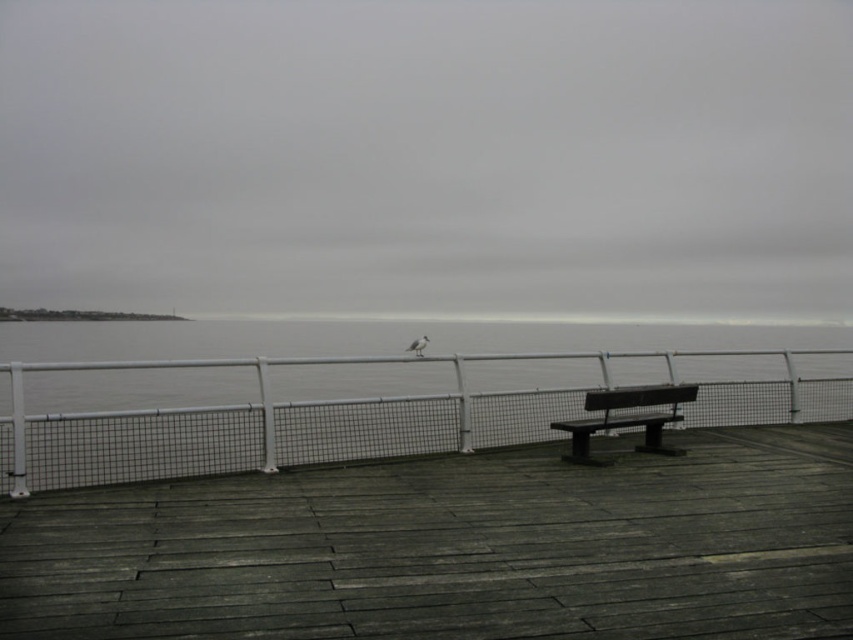
Consider the image. You are standing on the wooden deck and want to look at both the gray cloudy sky at upper center and the white metal fence at center. Which object is positioned to the left side from your viewpoint?

The gray cloudy sky at upper center is positioned to the left of the white metal fence at center.

You are standing on the wooden deck and want to walk towards the water. There are two points marked on the deck. Which point should you walk towards to get closer to the water faster? The points are point 1 at coordinates point (x=346, y=305) and point 2 at coordinates point (x=170, y=602).

You should walk towards point 2 at coordinates point (x=170, y=602) because it is closer to the water than point 1 at coordinates point (x=346, y=305).

Looking at this image, you are standing on the wooden pier and want to sit down. Which object, the weathered wood deck at center or the white metal fence at center, is closer to you where you can sit?

The weathered wood deck at center is closer to the viewer than the white metal fence at center, so you can sit on the weathered wood deck at center.